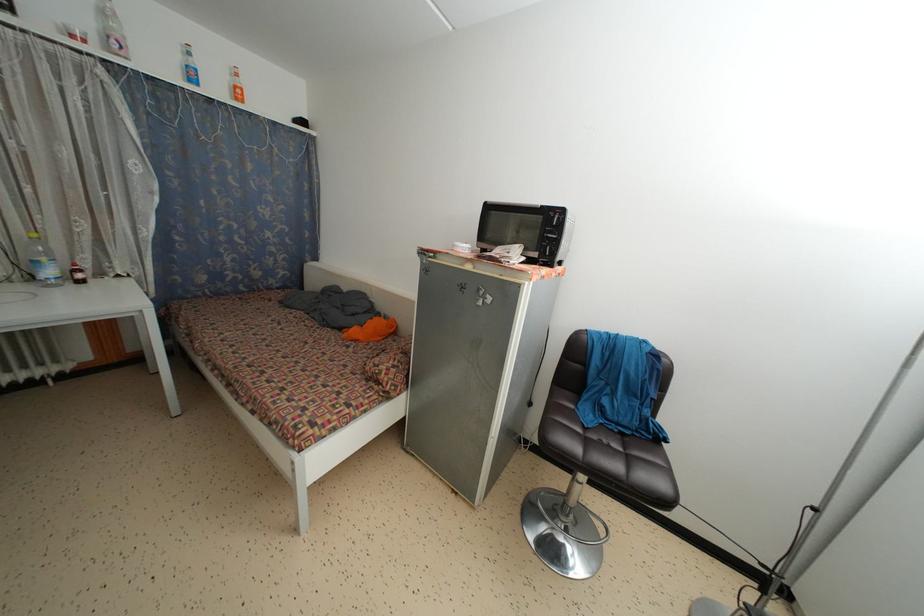
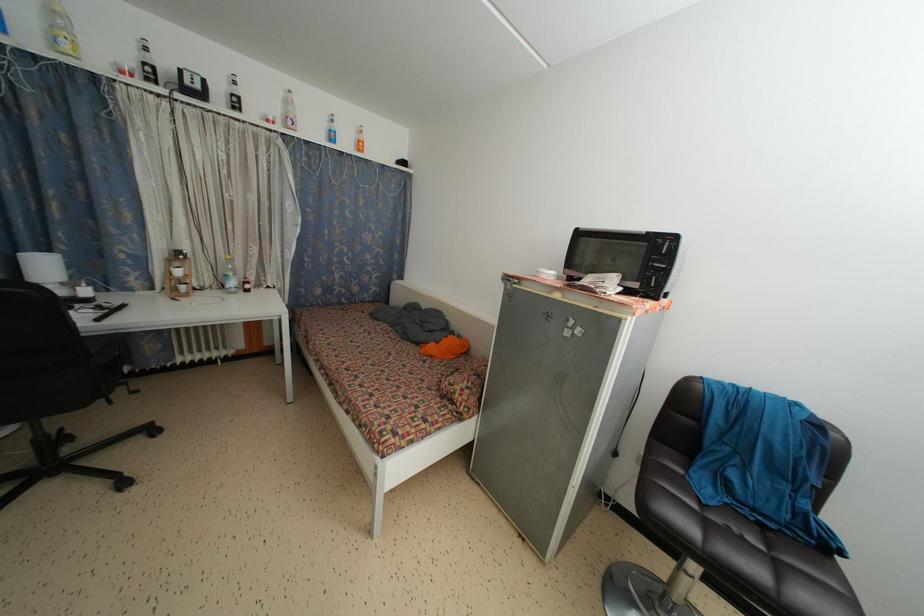
Where in the second image is the point corresponding to pixel 626 440 from the first image?

(767, 532)